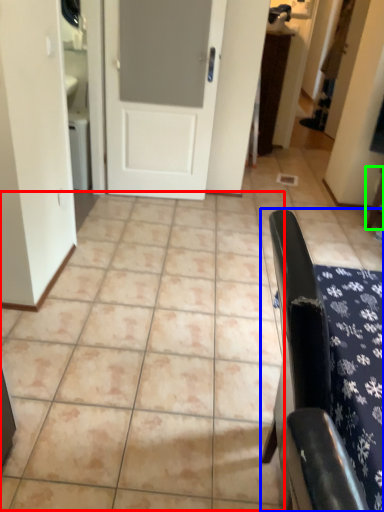
Question: Based on their relative distances, which object is nearer to ceramic tile (highlighted by a red box)? Choose from furniture (highlighted by a blue box) and furniture (highlighted by a green box).

Choices:
 (A) furniture
 (B) furniture

Answer: (A)